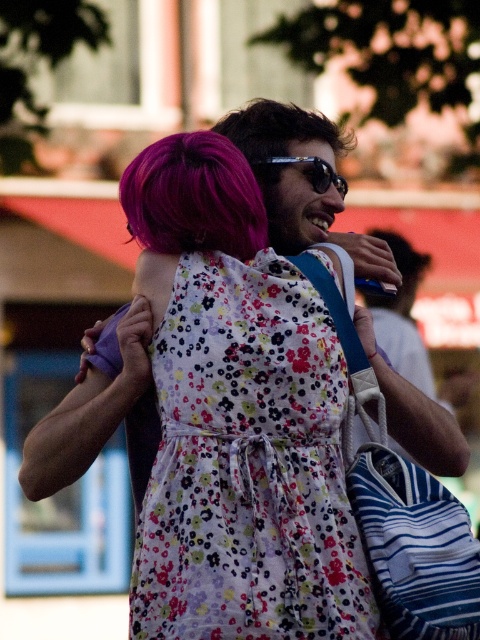
Question: Which object is closer to the camera taking this photo?

Choices:
 (A) purple matte hair at upper right
 (B) sunglasses at center

Answer: (A)

Question: Is purple matte hair at upper right thinner than sunglasses at center?

Choices:
 (A) yes
 (B) no

Answer: (B)

Question: Which point is closer to the camera?

Choices:
 (A) sunglasses at center
 (B) purple silky hair at upper center
 (C) floral cotton dress at center

Answer: (C)

Question: Can you confirm if floral cotton dress at center is smaller than purple silky hair at upper center?

Choices:
 (A) no
 (B) yes

Answer: (B)

Question: Can you confirm if floral cotton dress at center is positioned to the right of purple silky hair at upper center?

Choices:
 (A) yes
 (B) no

Answer: (A)

Question: Estimate the real-world distances between objects in this image. Which object is farther from the purple silky hair at upper center?

Choices:
 (A) purple matte hair at upper right
 (B) sunglasses at center

Answer: (A)